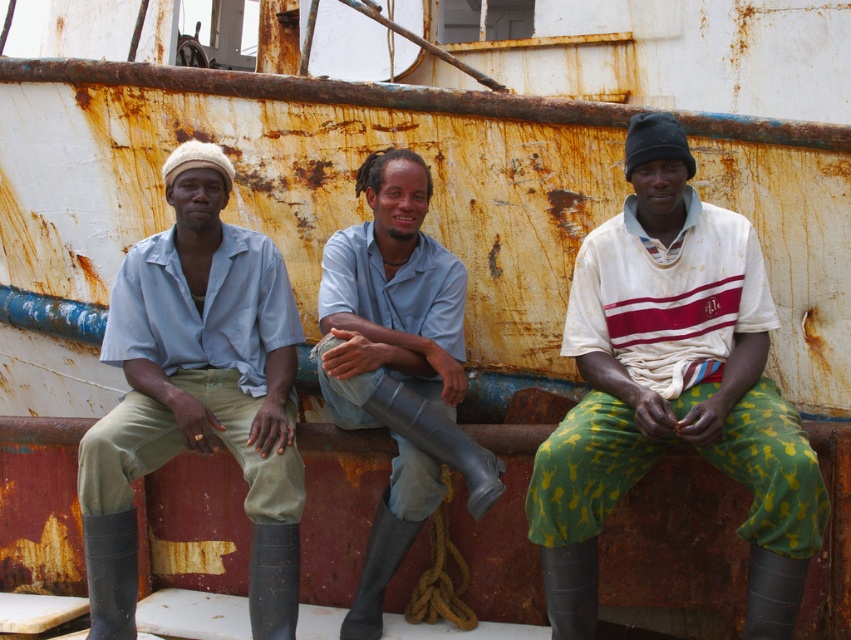
Question: Which point is closer to the camera?

Choices:
 (A) gray rubber boots at center
 (B) white striped shirt at center

Answer: (B)

Question: Which point is closer to the camera taking this photo?

Choices:
 (A) (665, 188)
 (B) (252, 417)
 (C) (369, 605)

Answer: (C)

Question: Does white striped shirt at center have a smaller size compared to matte blue shirt at center?

Choices:
 (A) no
 (B) yes

Answer: (A)

Question: Where is matte blue shirt at center located in relation to gray rubber boots at center in the image?

Choices:
 (A) above
 (B) below

Answer: (B)

Question: Considering the real-world distances, which object is farthest from the gray rubber boots at center?

Choices:
 (A) matte blue shirt at center
 (B) white striped shirt at center

Answer: (B)

Question: Can you confirm if matte blue shirt at center is wider than gray rubber boots at center?

Choices:
 (A) no
 (B) yes

Answer: (B)